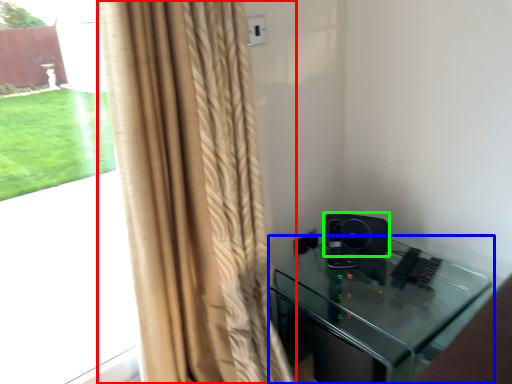
Question: Which object is positioned farthest from curtain (highlighted by a red box)? Select from furniture (highlighted by a blue box) and speaker (highlighted by a green box).

Choices:
 (A) furniture
 (B) speaker

Answer: (B)